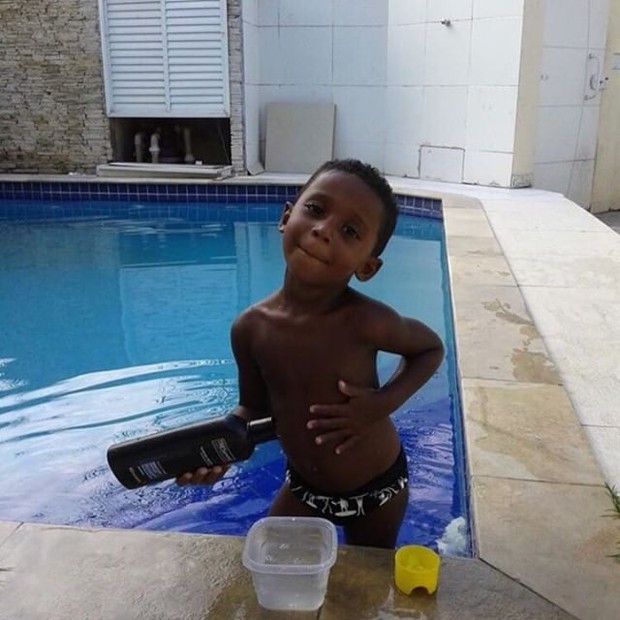
The width and height of the screenshot is (620, 620). Identify the location of white wall. (402, 118).